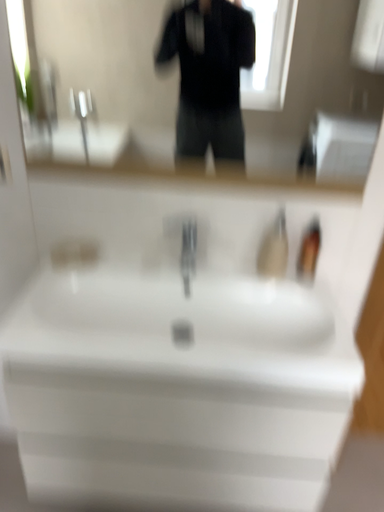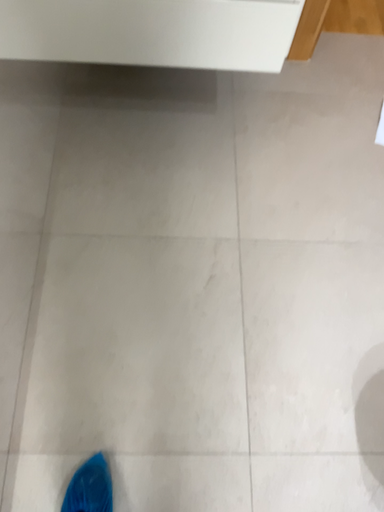
Question: Which way did the camera rotate in the video?

Choices:
 (A) rotated downward
 (B) rotated upward

Answer: (A)